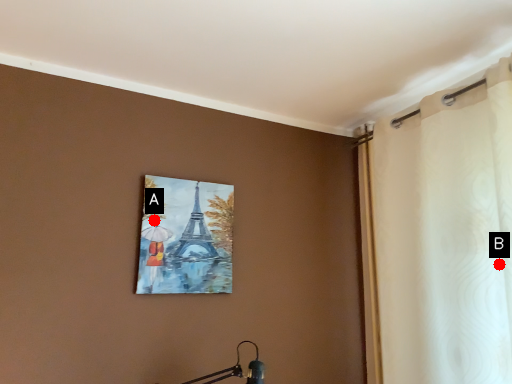
Question: Two points are circled on the image, labeled by A and B beside each circle. Which point is closer to the camera?

Choices:
 (A) A is closer
 (B) B is closer

Answer: (B)